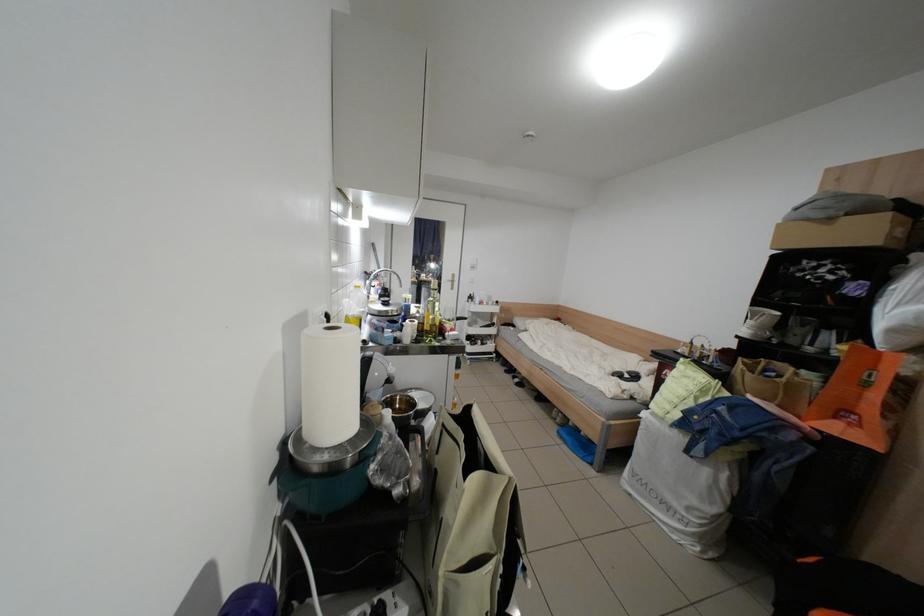
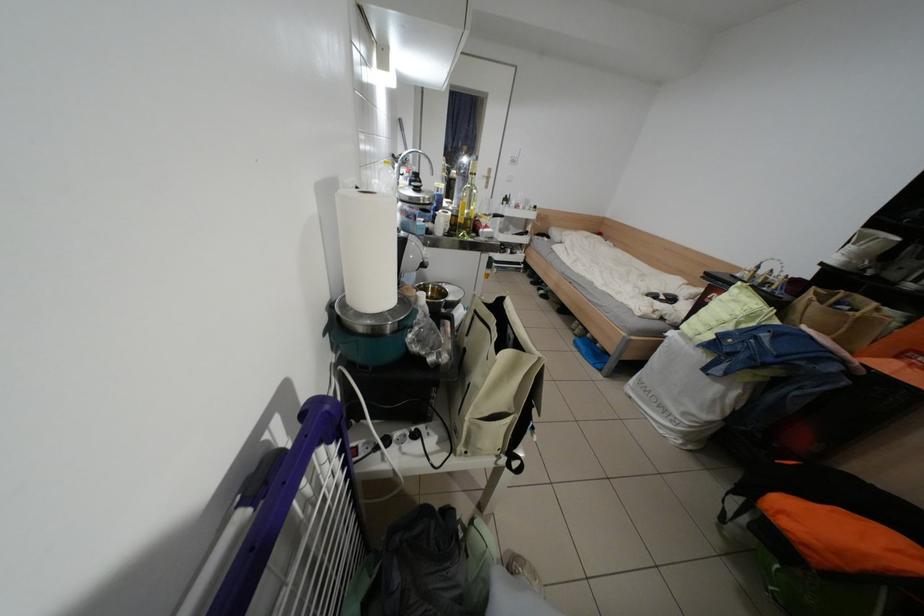
The point at [386,333] is marked in the first image. Where is the corresponding point in the second image?

(418, 220)